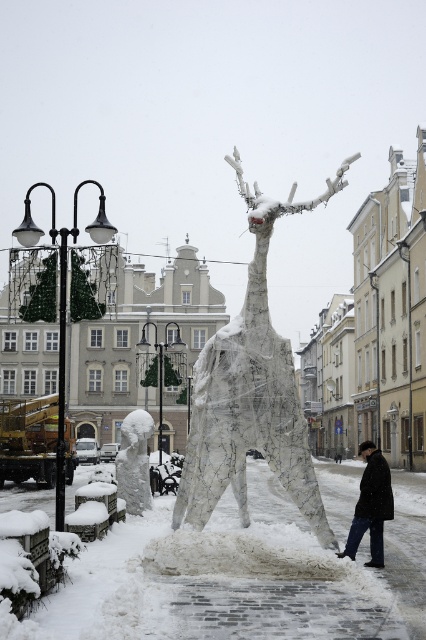
You are standing at the base of the deer sculpture and want to walk towards the point marked as point (316,532). Will you pass by point (126,436) on your way there?

Yes, because point (316,532) is in front of point (126,436), so you will pass by point (126,436) on your way there.

You are a delivery person trying to find the black wool coat at lower center in the snowy scene. You see the white wire mesh reindeer at center. Which direction should you move relative to the reindeer to locate the coat?

The white wire mesh reindeer at center is positioned on the left side of black wool coat at lower center. Therefore, you should move to the right of the white wire mesh reindeer at center to locate the black wool coat at lower center.